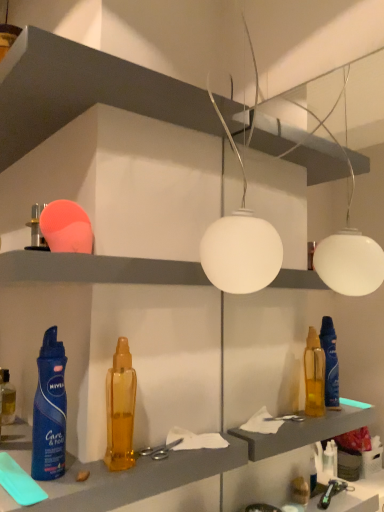
Image resolution: width=384 pixels, height=512 pixels. Identify the location of vacant area that lies to the right of blue matte spray can at lower left, which is the 1th bottle from front to back. (119, 469).